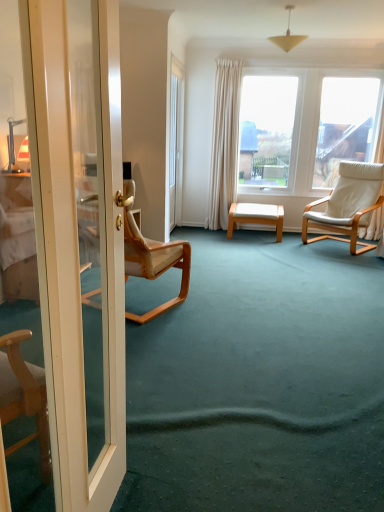
Question: From the image's perspective, is transparent glass door at center below white glossy door at left?

Choices:
 (A) yes
 (B) no

Answer: (B)

Question: From a real-world perspective, is transparent glass door at center located higher than white glossy door at left?

Choices:
 (A) no
 (B) yes

Answer: (B)

Question: Considering the relative sizes of transparent glass door at center and white glossy door at left in the image provided, is transparent glass door at center taller than white glossy door at left?

Choices:
 (A) no
 (B) yes

Answer: (B)

Question: Can you confirm if transparent glass door at center is positioned to the left of white glossy door at left?

Choices:
 (A) no
 (B) yes

Answer: (A)

Question: From the image's perspective, would you say transparent glass door at center is positioned over white glossy door at left?

Choices:
 (A) no
 (B) yes

Answer: (B)

Question: Is transparent glass door at center looking in the opposite direction of white glossy door at left?

Choices:
 (A) yes
 (B) no

Answer: (B)

Question: Does matte white cone at upper center have a lesser width compared to white wood stool at center?

Choices:
 (A) yes
 (B) no

Answer: (A)

Question: Could white wood stool at center be considered to be inside matte white cone at upper center?

Choices:
 (A) yes
 (B) no

Answer: (B)

Question: From a real-world perspective, does matte white cone at upper center stand above white wood stool at center?

Choices:
 (A) yes
 (B) no

Answer: (A)

Question: Considering the relative sizes of matte white cone at upper center and white wood stool at center in the image provided, is matte white cone at upper center smaller than white wood stool at center?

Choices:
 (A) no
 (B) yes

Answer: (B)

Question: From the image's perspective, is matte white cone at upper center beneath white wood stool at center?

Choices:
 (A) no
 (B) yes

Answer: (A)

Question: Considering the relative sizes of matte white cone at upper center and white wood stool at center in the image provided, is matte white cone at upper center bigger than white wood stool at center?

Choices:
 (A) yes
 (B) no

Answer: (B)

Question: Considering the relative positions of white leather chair at right, which is counted as the 2th chair, starting from the left, and transparent glass door at center in the image provided, is white leather chair at right, which is counted as the 2th chair, starting from the left, to the right of transparent glass door at center from the viewer's perspective?

Choices:
 (A) yes
 (B) no

Answer: (A)